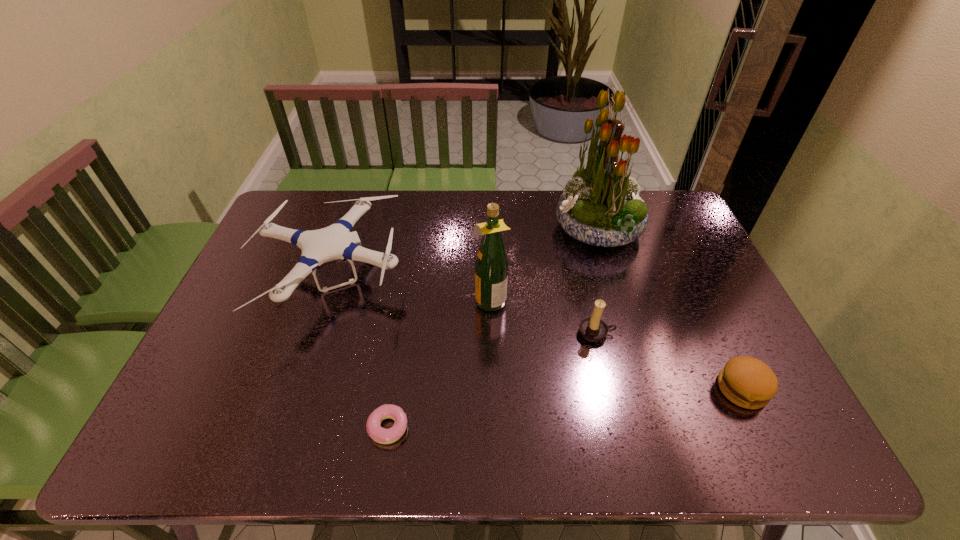
This screenshot has height=540, width=960. What are the coordinates of `object at the near edge` in the screenshot? It's located at (380, 435).

Find the location of a particular element. This screenshot has height=540, width=960. object at the left edge is located at coordinates (334, 242).

Where is `object present at the right edge`? object present at the right edge is located at coordinates (747, 382).

Where is `object situated at the far left corner`? The height and width of the screenshot is (540, 960). object situated at the far left corner is located at coordinates (334, 242).

Where is `free region at the far edge of the desktop`? The height and width of the screenshot is (540, 960). free region at the far edge of the desktop is located at coordinates (441, 210).

The image size is (960, 540). Find the location of `vacant region at the near edge`. vacant region at the near edge is located at coordinates (479, 433).

You are a GUI agent. You are given a task and a screenshot of the screen. Output one action in this format:
    pyautogui.click(x=<x>, y=<y>)
    Task: Click on the free space at the left edge
    This screenshot has width=960, height=540.
    Given the screenshot: What is the action you would take?
    pyautogui.click(x=171, y=407)

In the image, there is a desktop. Where is `vacant region at the right edge`? The height and width of the screenshot is (540, 960). vacant region at the right edge is located at coordinates (659, 264).

In the image, there is a desktop. Where is `vacant space at the near left corner`? The image size is (960, 540). vacant space at the near left corner is located at coordinates (215, 438).

What are the coordinates of `vacant space in between the liquor and the drone` in the screenshot? It's located at (411, 289).